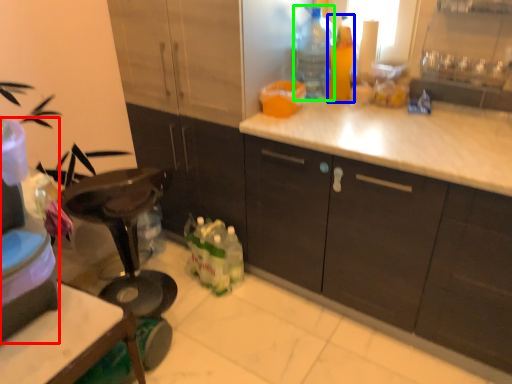
Question: Based on their relative distances, which object is farther from appliance (highlighted by a red box)? Choose from bottle (highlighted by a blue box) and bottle (highlighted by a green box).

Choices:
 (A) bottle
 (B) bottle

Answer: (A)